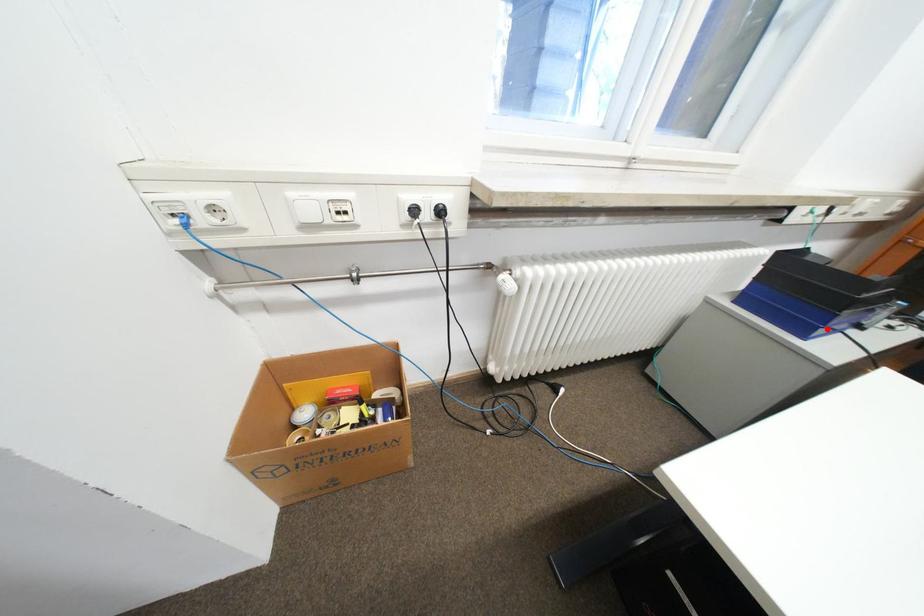
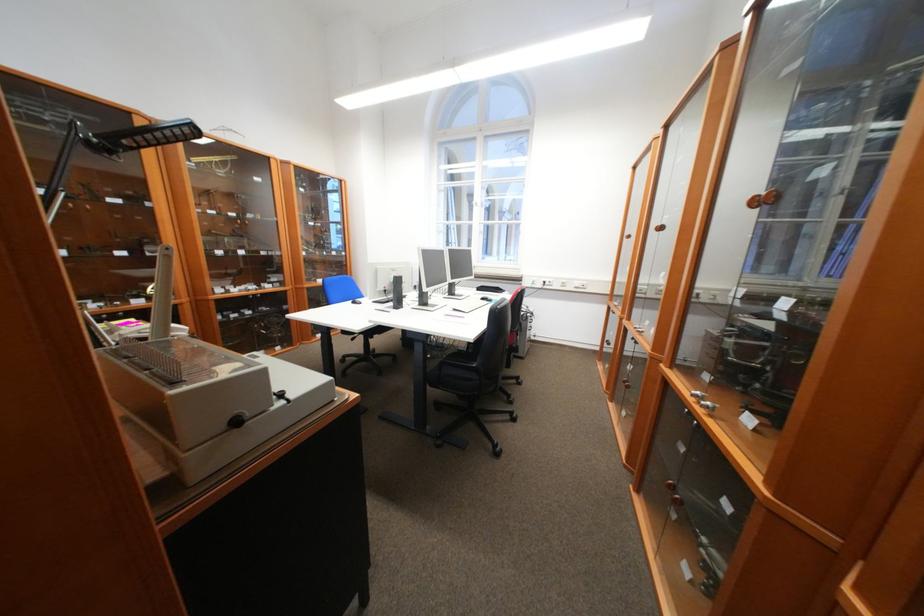
Question: I am providing you with two images of the same scene from different viewpoints. A red point is marked on the first image. Can you still see the location of the red point in image 2?

Choices:
 (A) Yes
 (B) No

Answer: (B)